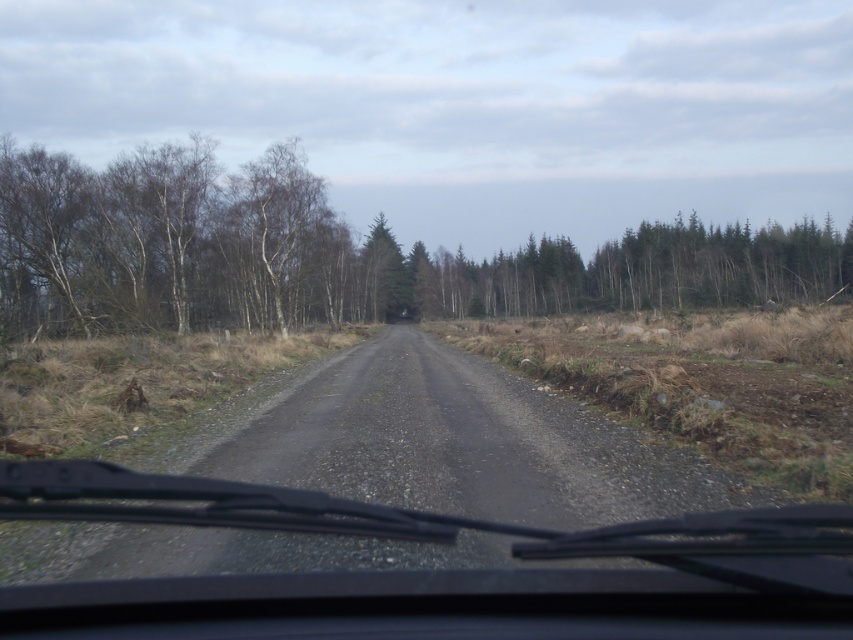
Question: Can you confirm if bare branches at left is positioned above green matte trees at center?

Choices:
 (A) yes
 (B) no

Answer: (B)

Question: Is bare branches at left smaller than green matte trees at center?

Choices:
 (A) yes
 (B) no

Answer: (B)

Question: Which of the following is the farthest from the observer?

Choices:
 (A) transparent rubber windshield at center
 (B) bare branches at left
 (C) green matte trees at center
 (D) green matte tree at center

Answer: (D)

Question: Which object is the farthest from the transparent rubber windshield at center?

Choices:
 (A) bare branches at left
 (B) green matte tree at center
 (C) green matte trees at center

Answer: (C)

Question: Estimate the real-world distances between objects in this image. Which object is farther from the green matte tree at center?

Choices:
 (A) transparent rubber windshield at center
 (B) bare branches at left

Answer: (A)

Question: In this image, where is transparent rubber windshield at center located relative to green matte trees at center?

Choices:
 (A) below
 (B) above

Answer: (A)